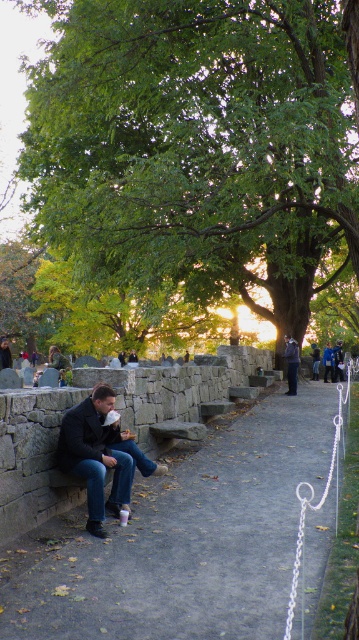
You are a photographer trying to capture the man sitting on the bench. You need to focus on both the blue denim jeans at center and the dark blue jacket at center. Which object should you adjust your camera to focus on first if you want to ensure the one closer to you is sharp?

The blue denim jeans at center is positioned on the right side of dark blue jacket at center, so you should focus on the blue denim jeans at center first since it is closer to you.

You are a person trying to find a place to sit. You see the matte stone bench at center and the matte black jacket at left. Which one is shorter?

The matte stone bench at center is shorter than the matte black jacket at left because the description states that the bench is not as tall as the jacket.

You are a photographer standing on the pathway in the scene. You want to take a photo of the dark blue jacket at center and blue denim jeans at center. Which object should you focus on first if you want to capture both clearly in the same frame?

You should focus on the dark blue jacket at center first because it is behind the blue denim jeans at center, so focusing on the farther object will help ensure both are in focus.